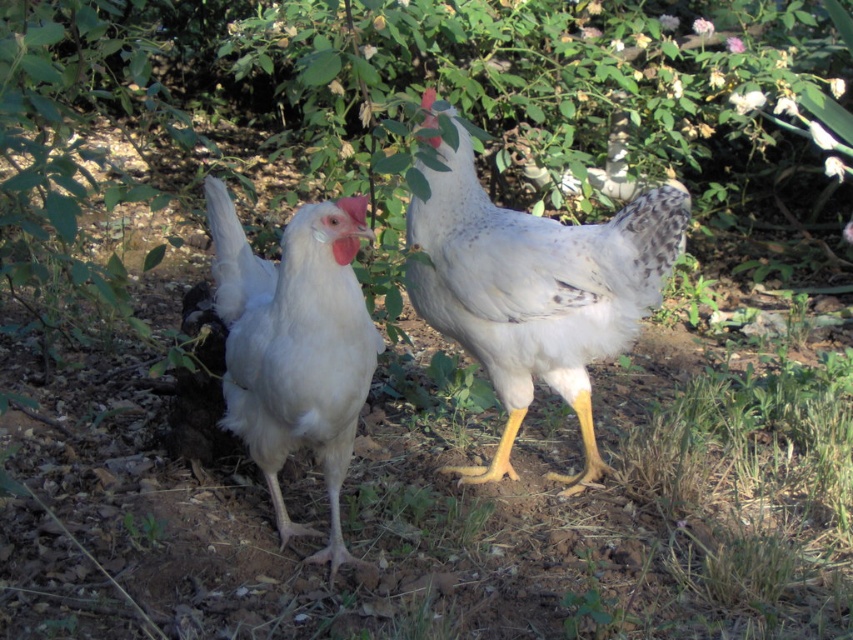
You are a farmer checking the chickens in your coop. You notice a white speckled feather at center and a white feathered chicken at center. Which object is bigger?

The white speckled feather at center is larger in size than the white feathered chicken at center.

You are a birdwatcher observing two chickens in a garden. You notice a point marked at coordinates (537, 291). Which object from the scene does this point correspond to?

The point at coordinates (537, 291) corresponds to the white speckled feather at center.